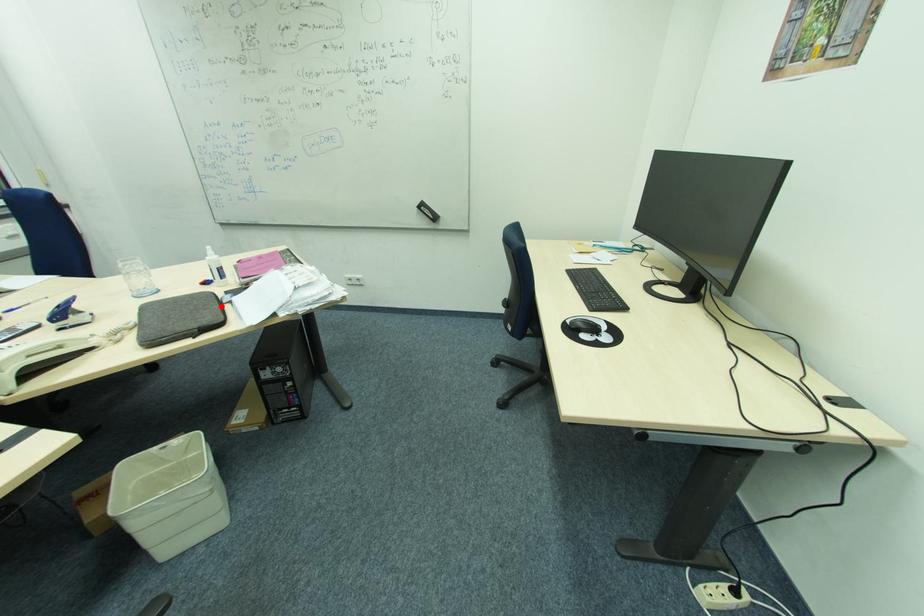
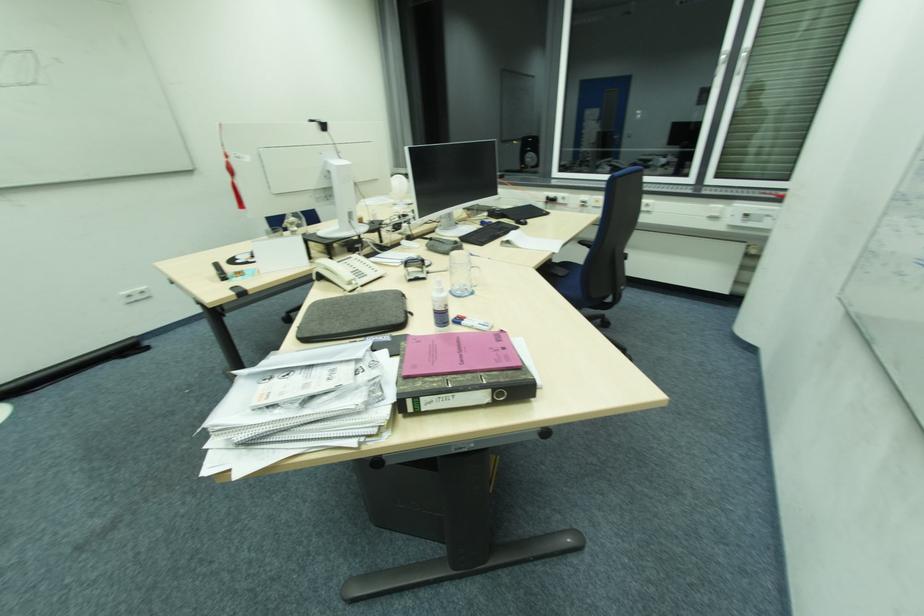
Where in the second image is the point corresponding to the highlighted location from the first image?

(348, 331)